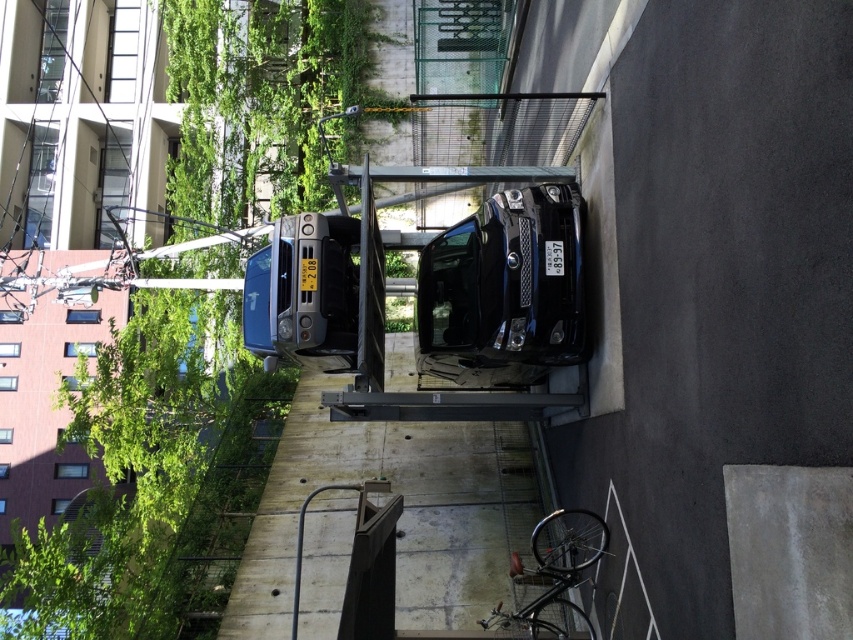
Is green leafy vegetation at upper left further to the viewer compared to concrete wall at center?

Yes, green leafy vegetation at upper left is further from the viewer.

Looking at this image, can you confirm if green leafy vegetation at upper left is shorter than concrete wall at center?

No.

You are a GUI agent. You are given a task and a screenshot of the screen. Output one action in this format:
    pyautogui.click(x=<x>, y=<y>)
    Task: Click on the green leafy vegetation at upper left
    The height and width of the screenshot is (640, 853).
    Given the screenshot: What is the action you would take?
    pyautogui.click(x=119, y=451)

Identify the location of green leafy vegetation at upper left. This screenshot has width=853, height=640. (119, 451).